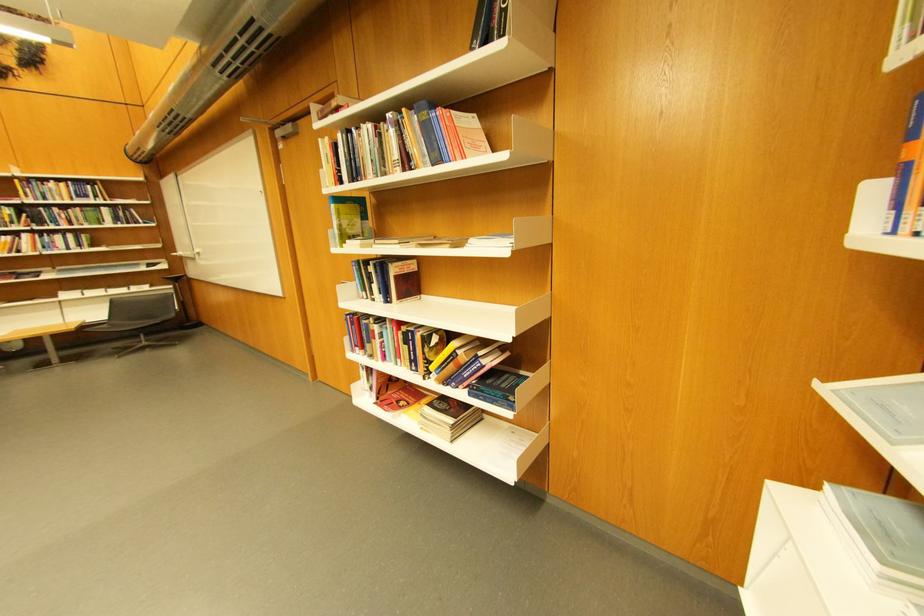
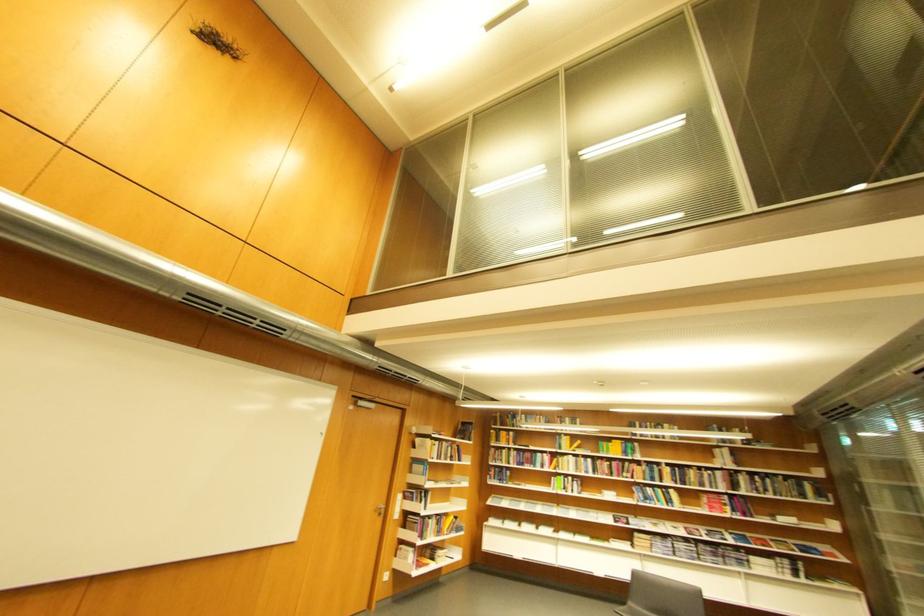
Where in the second image is the point corresponding to (415,172) from the first image?

(460, 461)